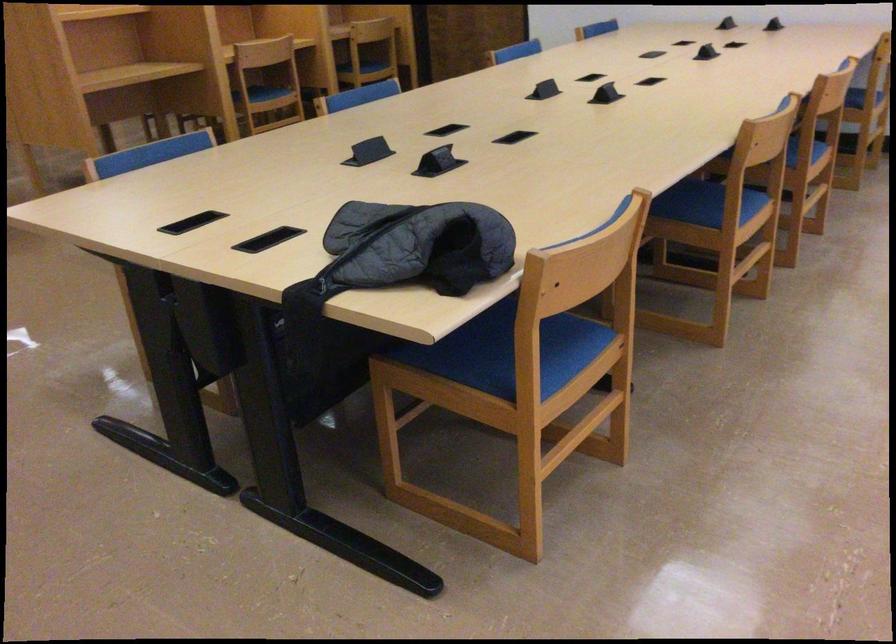
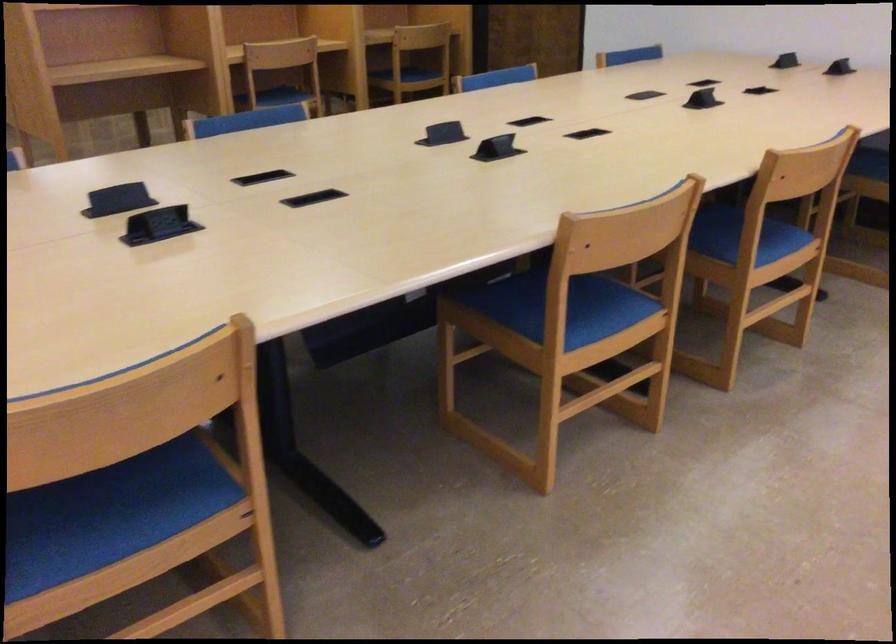
Which direction would the cameraman need to move to produce the second image?

The cameraman moved toward right, forward.